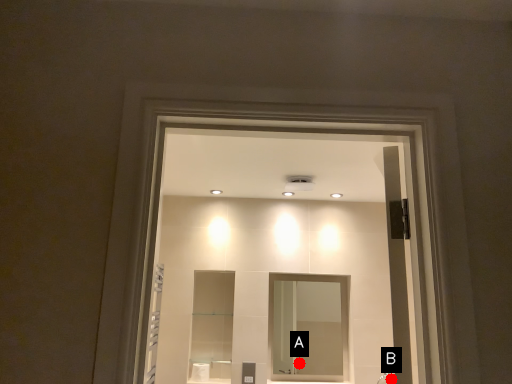
Question: Two points are circled on the image, labeled by A and B beside each circle. Which of the following is the farthest from the observer?

Choices:
 (A) A is further
 (B) B is further

Answer: (A)